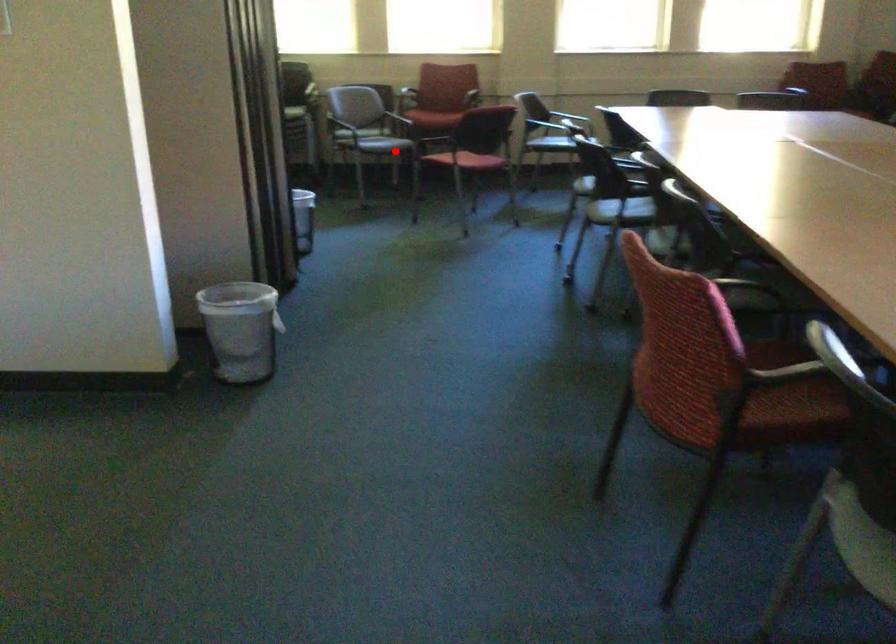
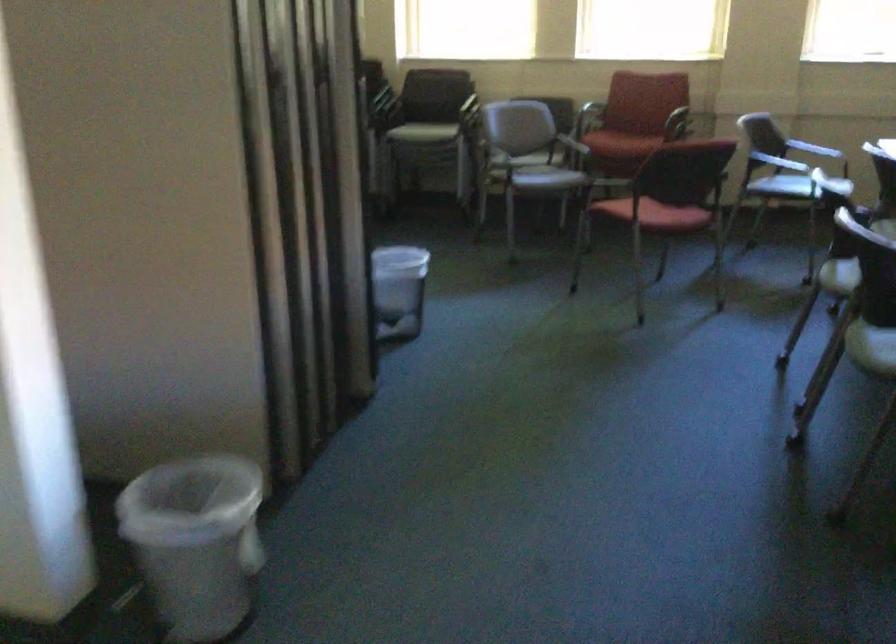
Locate, in the second image, the point that corresponds to the highlighted location in the first image.

(545, 180)